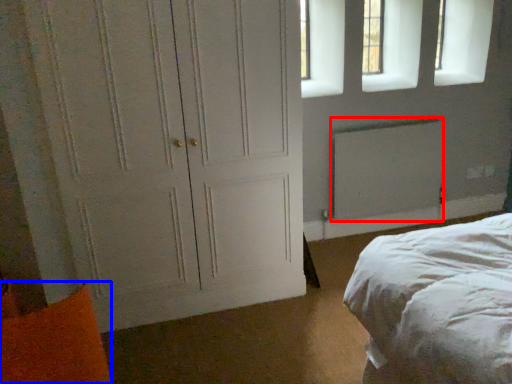
Question: Which point is further to the camera, radiator (highlighted by a red box) or pillow (highlighted by a blue box)?

Choices:
 (A) radiator
 (B) pillow

Answer: (A)